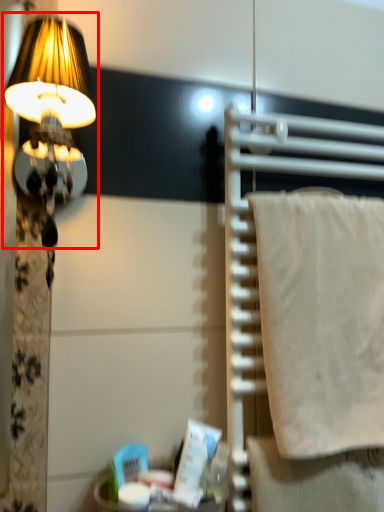
Question: In this image, where is lamp (annotated by the red box) located relative to wrap?

Choices:
 (A) left
 (B) right

Answer: (A)